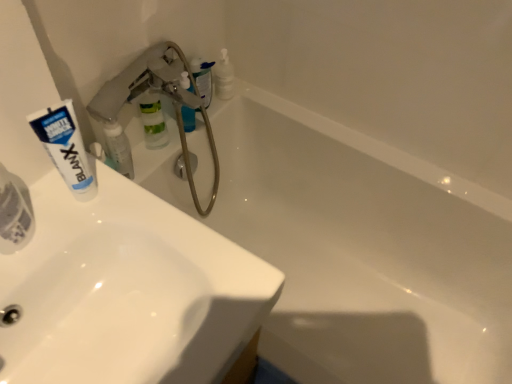
Where is `vacant space in front of white matte tube at upper left`? This screenshot has width=512, height=384. vacant space in front of white matte tube at upper left is located at coordinates (72, 257).